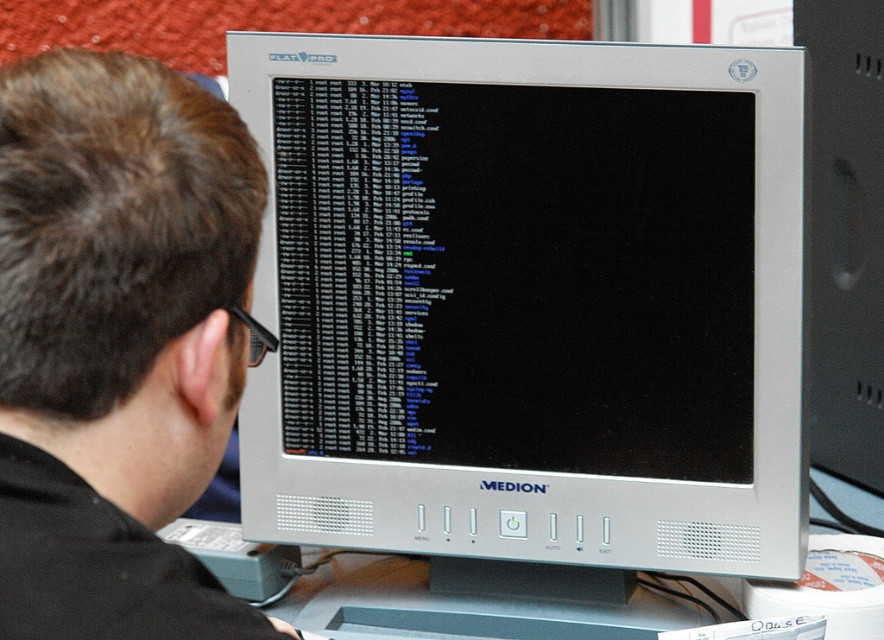
You are setting up a new workspace and need to place two monitors on your desk. The silver metallic computer monitor at center and the black matte monitor at upper center are both available. If you want to place the larger monitor closer to you, which one should you choose?

Answer: The silver metallic computer monitor at center is larger than the black matte monitor at upper center, so you should place the silver metallic computer monitor at center closer to you.

You are trying to organize your desk and need to know the relative positions of the silver metallic computer monitor at center and the black matte monitor at upper center. Which one is positioned to the right of the other?

The silver metallic computer monitor at center is positioned to the right of the black matte monitor at upper center.